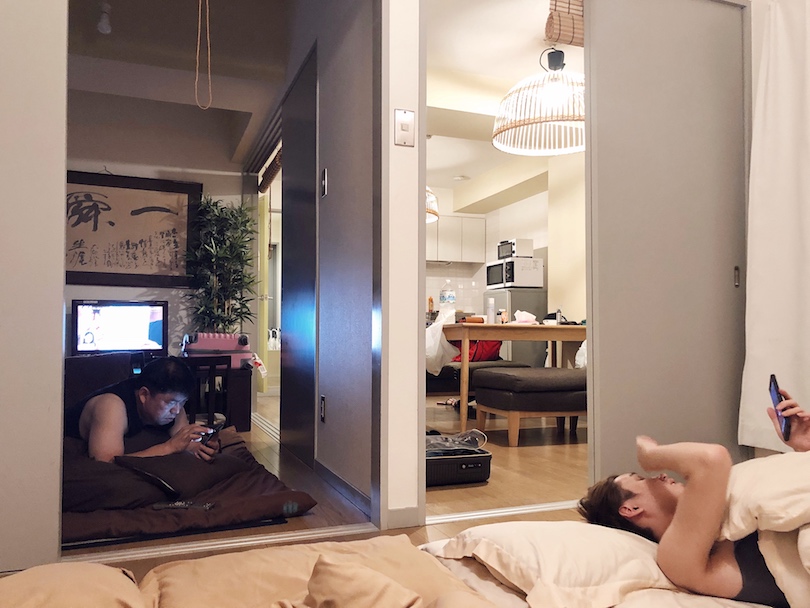
In order to click on picture in this screenshot , I will do `click(142, 230)`.